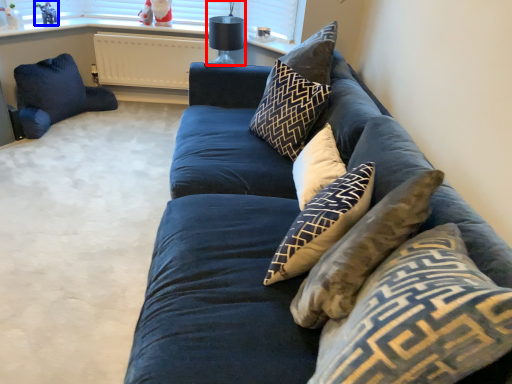
Question: Which object appears closest to the camera in this image, lamp (highlighted by a red box) or toy (highlighted by a blue box)?

Choices:
 (A) lamp
 (B) toy

Answer: (A)